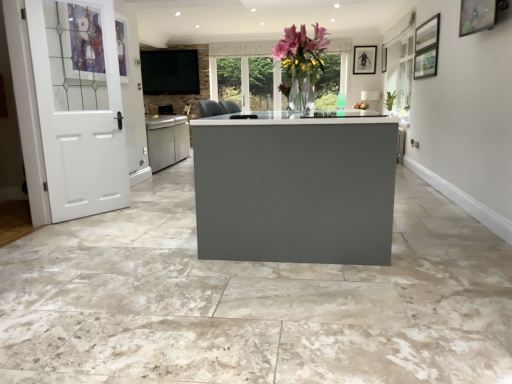
Locate an element on the screen. The width and height of the screenshot is (512, 384). free point to the right of white painted wood door at left is located at coordinates (136, 216).